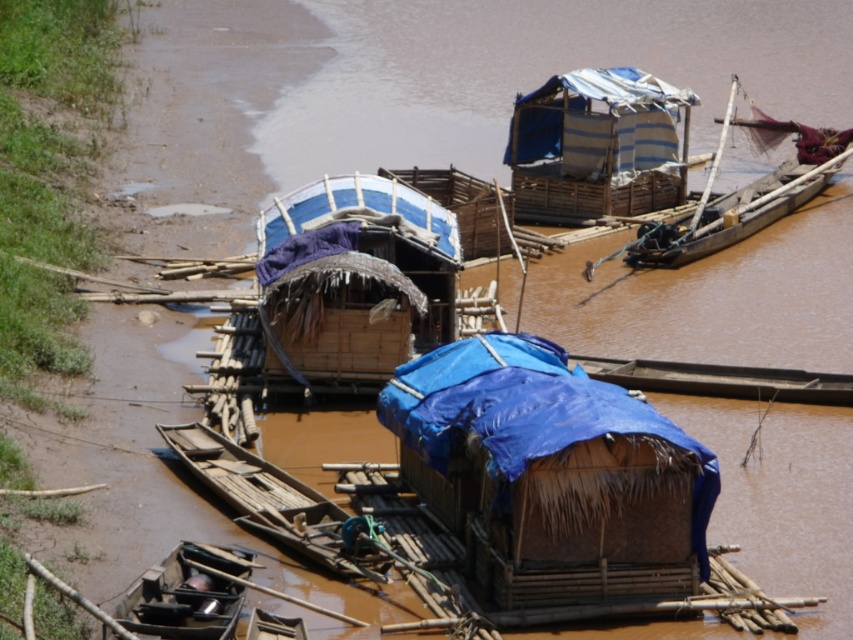
You are standing on the riverbank looking at the boats. Which object is located at the coordinates point (550, 472)?

The point (550, 472) corresponds to the blue tarpaulin hut at center.

You are standing on the muddy riverbank and see the black matte boat at lower left and the blue tarpaulin boat at center. Which boat is closer to the water surface?

The black matte boat at lower left is positioned under the blue tarpaulin boat at center, so it is closer to the water surface.

You are standing at the riverbank and see two points marked on the ground. The first point is at coordinate point(206,627) and the second is at point(657,372). Which point is closer to you?

Point point(206,627) is closer to you because it is in front of point point(657,372).